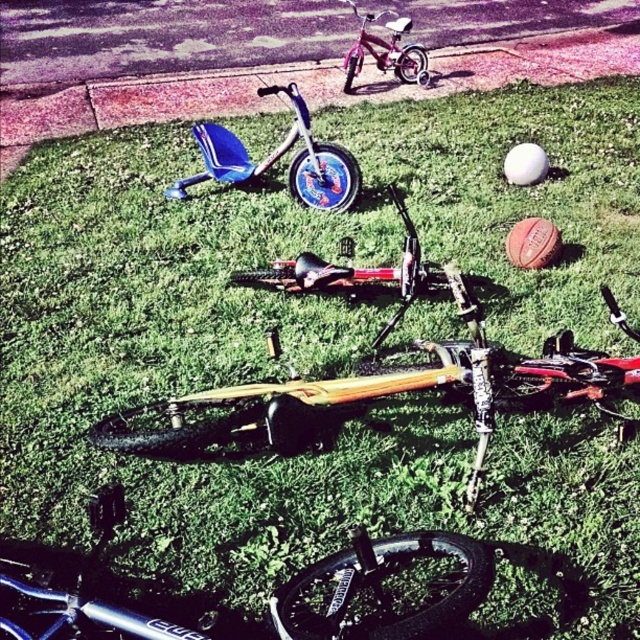
Question: Which object is positioned closest to the shiny blue bicycle at lower center?

Choices:
 (A) yellow matte bicycle at center
 (B) blue plastic tricycle at center
 (C) metallic silver bicycle at center
 (D) pink metallic bicycle at upper center

Answer: (A)

Question: Is yellow matte bicycle at center positioned in front of metallic silver bicycle at center?

Choices:
 (A) no
 (B) yes

Answer: (B)

Question: Which point is closer to the camera?

Choices:
 (A) yellow matte bicycle at center
 (B) pink metallic bicycle at upper center
 (C) metallic silver bicycle at center

Answer: (A)

Question: Does metallic silver bicycle at center appear on the left side of pink metallic bicycle at upper center?

Choices:
 (A) yes
 (B) no

Answer: (A)

Question: Can you confirm if shiny blue bicycle at lower center is thinner than metallic silver bicycle at center?

Choices:
 (A) no
 (B) yes

Answer: (B)

Question: Which object is closer to the camera taking this photo?

Choices:
 (A) shiny blue bicycle at lower center
 (B) blue plastic tricycle at center

Answer: (A)